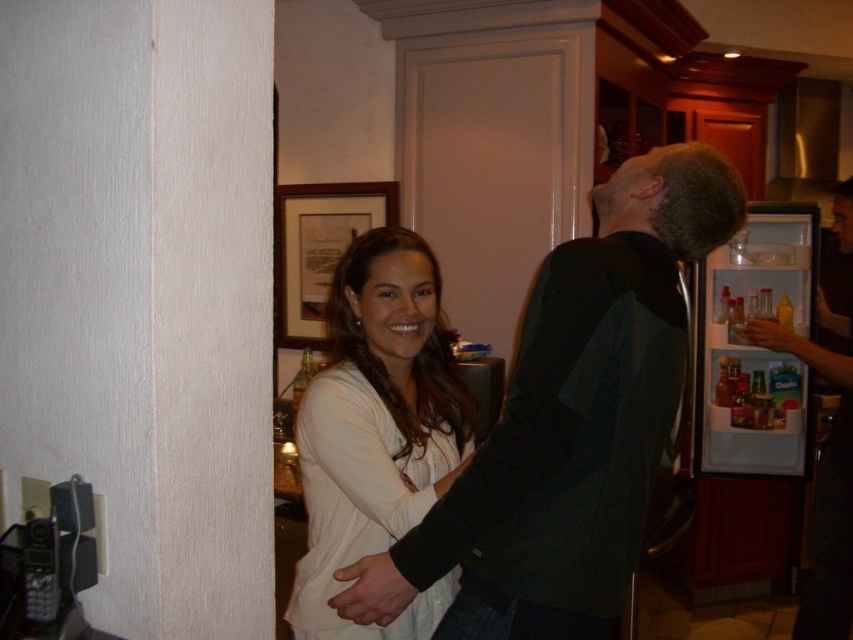
You are organizing a photo shoot in this room and need to position a model near the dark green sweater at right and the wooden frame at upper center. Which object should you place the model closer to if you want them to be positioned to the left side of the room?

The model should be placed closer to the wooden frame at upper center because the dark green sweater at right is located to its right. Positioning the model near the wooden frame at upper center would place them to the left side of the room.

You are organizing a small event and need to decide which item to place on a shelf that can only hold items smaller than the wooden frame at upper center. Can the dark green sweater at right be placed there?

The dark green sweater at right is bigger than the wooden frame at upper center, so it cannot be placed on the shelf since the shelf can only hold items smaller than the wooden frame at upper center.